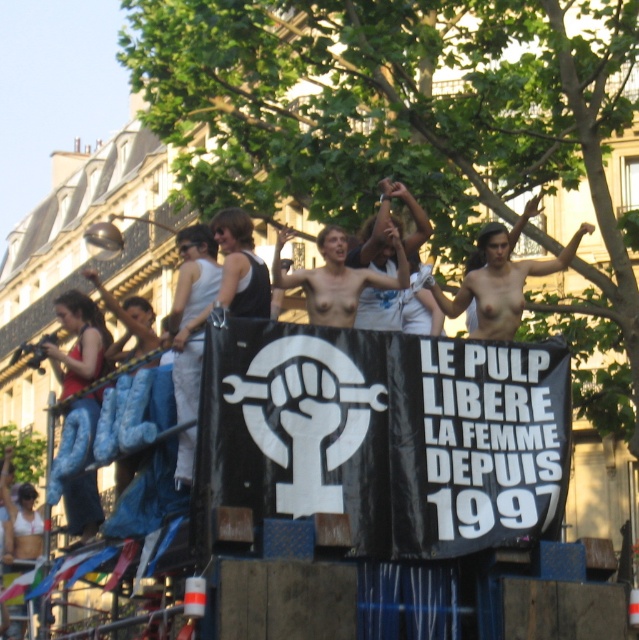
You are standing in the crowd watching the parade float. There are two points marked on the float. Which point is closer to you, point (530, 374) or point (334, 248)?

Point (530, 374) is closer to the viewer than point (334, 248).

You are a photographer trying to capture the perfect shot of the skinny white torso at center from a specific angle. If you position your camera at coordinates 0.5, 0.8, will the torso be in your frame?

The skinny white torso at center is at point (502, 280), so positioning the camera at (511, 320) would place it slightly to the right and above the torso, likely keeping it within the frame.

In the parade scene, you notice the black fabric banner at center and the nude torso at center. Which object is positioned more to the right?

The black fabric banner at center is positioned to the right of the nude torso at center.